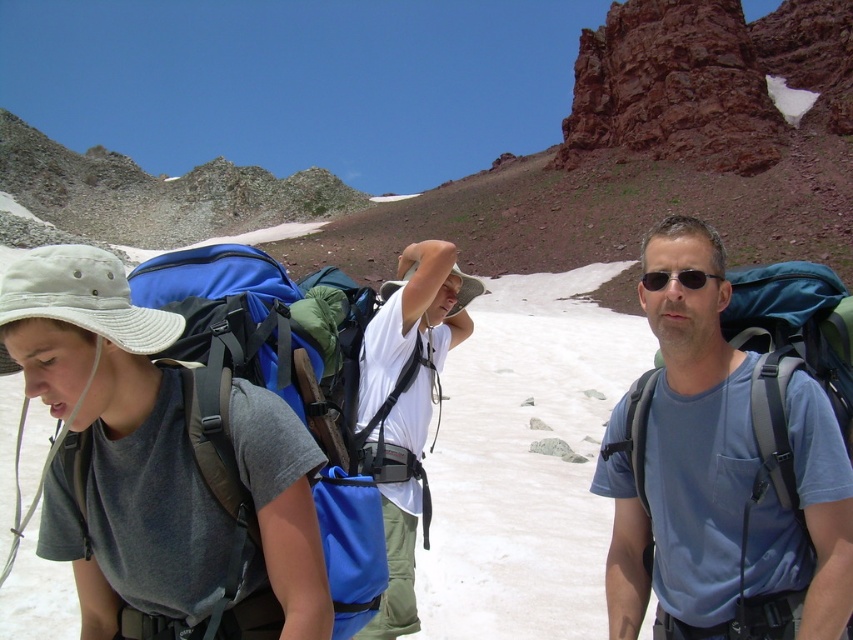
Who is more forward, (351, 376) or (694, 280)?

Point (694, 280) is more forward.

Is point (231, 474) more distant than point (646, 278)?

No, (231, 474) is closer to viewer.

Image resolution: width=853 pixels, height=640 pixels. I want to click on blue fabric backpack at left, so click(277, 396).

From the picture: Can you confirm if blue fabric backpack at center-right is positioned below blue fabric backpack at left?

Actually, blue fabric backpack at center-right is above blue fabric backpack at left.

Is blue fabric backpack at center-right further to camera compared to blue fabric backpack at left?

No.

Which is in front, point (671, 371) or point (341, 336)?

Point (671, 371) is in front.

Locate an element on the screen. blue fabric backpack at center-right is located at coordinates (722, 477).

Is blue fabric backpack at center-right to the left of black plastic sunglasses at center from the viewer's perspective?

No, blue fabric backpack at center-right is not to the left of black plastic sunglasses at center.

Does blue fabric backpack at center-right have a larger size compared to black plastic sunglasses at center?

Yes, blue fabric backpack at center-right is bigger than black plastic sunglasses at center.

At what (x,y) coordinates should I click in order to perform the action: click on blue fabric backpack at center-right. Please return your answer as a coordinate pair (x, y). This screenshot has width=853, height=640. Looking at the image, I should click on (722, 477).

Identify the location of blue fabric backpack at center-right. (722, 477).